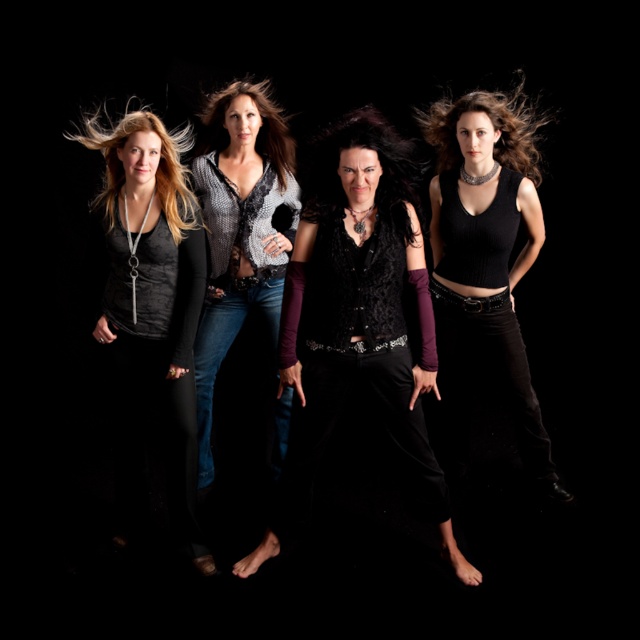
Does velvet black vest at center appear over matte black top at left?

No, velvet black vest at center is not above matte black top at left.

Is velvet black vest at center in front of matte black top at left?

Yes, it is in front of matte black top at left.

Locate an element on the screen. The width and height of the screenshot is (640, 640). velvet black vest at center is located at coordinates (358, 314).

At what (x,y) coordinates should I click in order to perform the action: click on velvet black vest at center. Please return your answer as a coordinate pair (x, y). The width and height of the screenshot is (640, 640). Looking at the image, I should click on (358, 314).

Does black ribbed tank top at center have a greater width compared to blonde silky hair at left?

Indeed, black ribbed tank top at center has a greater width compared to blonde silky hair at left.

The width and height of the screenshot is (640, 640). What do you see at coordinates (486, 250) in the screenshot? I see `black ribbed tank top at center` at bounding box center [486, 250].

You are a GUI agent. You are given a task and a screenshot of the screen. Output one action in this format:
    pyautogui.click(x=<x>, y=<y>)
    Task: Click on the black ribbed tank top at center
    The image size is (640, 640).
    Given the screenshot: What is the action you would take?
    pyautogui.click(x=486, y=250)

Who is higher up, black ribbed tank top at center or brownhair at center?

Positioned higher is brownhair at center.

Is black ribbed tank top at center positioned at the back of brownhair at center?

No, black ribbed tank top at center is in front of brownhair at center.

Is point (540, 422) positioned after point (472, 109)?

Yes, it is behind point (472, 109).

Where is `black ribbed tank top at center`? black ribbed tank top at center is located at coordinates (486, 250).